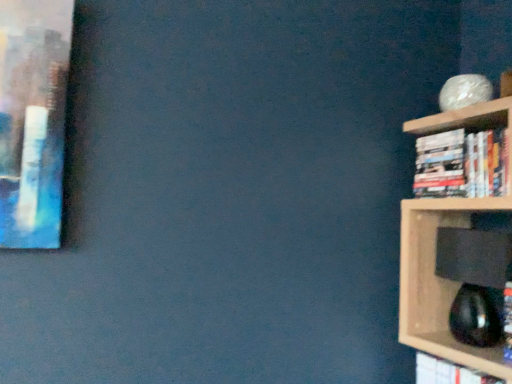
Question: From the image's perspective, is hardcover books at right, the second book ordered from the bottom, below hardcover book at right, which appears as the second book when viewed from the top?

Choices:
 (A) no
 (B) yes

Answer: (A)

Question: From the image's perspective, is hardcover books at right, the 1th book when ordered from top to bottom, on hardcover book at right, which appears as the second book when viewed from the top?

Choices:
 (A) yes
 (B) no

Answer: (A)

Question: Does hardcover books at right, the second book ordered from the bottom, appear on the right side of hardcover book at right, which is counted as the 1th book, starting from the bottom?

Choices:
 (A) no
 (B) yes

Answer: (B)

Question: Is hardcover books at right, the second book ordered from the bottom, closer to camera compared to hardcover book at right, which is counted as the 1th book, starting from the bottom?

Choices:
 (A) yes
 (B) no

Answer: (B)

Question: From a real-world perspective, is hardcover books at right, the second book ordered from the bottom, physically below hardcover book at right, which is counted as the 1th book, starting from the bottom?

Choices:
 (A) no
 (B) yes

Answer: (A)

Question: Is hardcover books at right, the second book ordered from the bottom, next to hardcover book at right, which appears as the second book when viewed from the top?

Choices:
 (A) no
 (B) yes

Answer: (A)

Question: Can you confirm if hardcover book at right, which is counted as the 1th book, starting from the bottom, is positioned to the right of hardcover books at right, the second book ordered from the bottom?

Choices:
 (A) yes
 (B) no

Answer: (B)

Question: Is hardcover book at right, which is counted as the 1th book, starting from the bottom, aimed at hardcover books at right, the 1th book when ordered from top to bottom?

Choices:
 (A) no
 (B) yes

Answer: (A)

Question: Is hardcover books at right, the second book ordered from the bottom, at the back of hardcover book at right, which is counted as the 1th book, starting from the bottom?

Choices:
 (A) yes
 (B) no

Answer: (B)

Question: Can you confirm if hardcover book at right, which is counted as the 1th book, starting from the bottom, is wider than hardcover books at right, the second book ordered from the bottom?

Choices:
 (A) yes
 (B) no

Answer: (B)

Question: Is hardcover book at right, which appears as the second book when viewed from the top, to the left of hardcover books at right, the 1th book when ordered from top to bottom, from the viewer's perspective?

Choices:
 (A) no
 (B) yes

Answer: (B)

Question: Does hardcover book at right, which appears as the second book when viewed from the top, have a lesser width compared to hardcover books at right, the 1th book when ordered from top to bottom?

Choices:
 (A) yes
 (B) no

Answer: (A)

Question: From the image's perspective, is hardcover book at right, which appears as the second book when viewed from the top, positioned above or below hardcover books at right, the 1th book when ordered from top to bottom?

Choices:
 (A) above
 (B) below

Answer: (B)